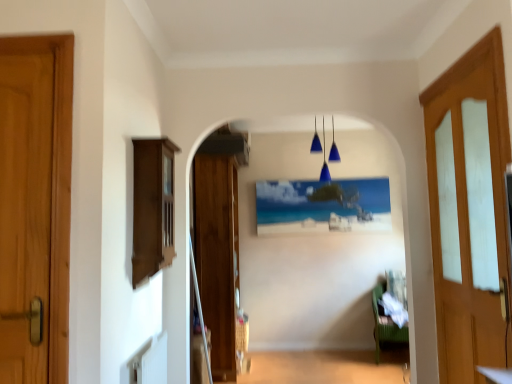
Image resolution: width=512 pixels, height=384 pixels. I want to click on wooden door at left, which is the 1th door from left to right, so tap(57, 190).

This screenshot has width=512, height=384. I want to click on matte plastic picture frame at center, so click(x=323, y=206).

Find the location of a particular element. Image resolution: width=512 pixels, height=384 pixels. green fabric couch at lower right is located at coordinates (385, 325).

Based on their sizes in the image, would you say blue glass pendant lights at center is bigger or smaller than wooden door at center, which is the second door from left to right?

blue glass pendant lights at center is smaller than wooden door at center, which is the second door from left to right.

Is blue glass pendant lights at center oriented towards wooden door at center, the first door viewed from the back?

No, blue glass pendant lights at center is not facing towards wooden door at center, the first door viewed from the back.

Considering the relative positions of blue glass pendant lights at center and wooden door at center, the second door viewed from the right, in the image provided, is blue glass pendant lights at center behind wooden door at center, the second door viewed from the right,?

Yes, it is behind wooden door at center, the second door viewed from the right.

Considering the points (334, 153) and (227, 269), which point is behind, point (334, 153) or point (227, 269)?

Positioned behind is point (334, 153).

From a real-world perspective, which is physically below, blue glass pendant lights at center or green fabric couch at lower right?

green fabric couch at lower right, from a real-world perspective.

You are a GUI agent. You are given a task and a screenshot of the screen. Output one action in this format:
    pyautogui.click(x=<x>, y=<y>)
    Task: Click on the furniture below the blue glass pendant lights at center (from the image's perspective)
    
    Given the screenshot: What is the action you would take?
    pyautogui.click(x=385, y=325)

Is blue glass pendant lights at center bigger or smaller than green fabric couch at lower right?

Clearly, blue glass pendant lights at center is smaller in size than green fabric couch at lower right.

Considering the relative positions of blue glass pendant lights at center and green fabric couch at lower right in the image provided, is blue glass pendant lights at center in front of green fabric couch at lower right?

That is True.

Which is closer to the camera, (259, 361) or (215, 284)?

Point (259, 361) is farther from the camera than point (215, 284).

Could you tell me if wooden staircase at center is facing wooden door at center, the third door from the front?

No.

In terms of size, does wooden staircase at center appear bigger or smaller than wooden door at center, the second door viewed from the right?

Considering their sizes, wooden staircase at center takes up less space than wooden door at center, the second door viewed from the right.

Is green fabric couch at lower right placed right next to wooden door at left, which appears as the first door when viewed from the front?

There is a gap between green fabric couch at lower right and wooden door at left, which appears as the first door when viewed from the front.

Is green fabric couch at lower right thinner than wooden door at left, which appears as the first door when viewed from the front?

No.

Where is `door that is the 3rd object located in front of the green fabric couch at lower right`? The height and width of the screenshot is (384, 512). door that is the 3rd object located in front of the green fabric couch at lower right is located at coordinates (57, 190).

Is green fabric couch at lower right turned away from wooden door at left, the third door viewed from the back?

No, green fabric couch at lower right's orientation is not away from wooden door at left, the third door viewed from the back.

From a real-world perspective, is matte plastic picture frame at center positioned over wooden door at center, the third door from the front, based on gravity?

Yes, from a real-world perspective, matte plastic picture frame at center is over wooden door at center, the third door from the front

Does point (367, 193) come closer to viewer compared to point (201, 289)?

No, (367, 193) is behind (201, 289).

From the image's perspective, is matte plastic picture frame at center above or below wooden door at center, the third door from the front?

From the image's perspective, matte plastic picture frame at center appears above wooden door at center, the third door from the front.

Considering the relative sizes of matte plastic picture frame at center and wooden door at center, which is the second door from left to right, in the image provided, is matte plastic picture frame at center smaller than wooden door at center, which is the second door from left to right,?

Yes.

From the image's perspective, is matte plastic picture frame at center located above or below brown wood cabinet at left?

matte plastic picture frame at center is situated lower than brown wood cabinet at left in the image.

Which object is wider, matte plastic picture frame at center or brown wood cabinet at left?

With larger width is brown wood cabinet at left.

Would you say matte plastic picture frame at center contains brown wood cabinet at left?

No, brown wood cabinet at left is not a part of matte plastic picture frame at center.

How distant is matte plastic picture frame at center from brown wood cabinet at left?

matte plastic picture frame at center and brown wood cabinet at left are 8.10 feet apart.

From the image's perspective, is white glossy table at lower right located above or below brown wood cabinet at left?

Clearly, from the image's perspective, white glossy table at lower right is below brown wood cabinet at left.

Does white glossy table at lower right appear on the left side of brown wood cabinet at left?

In fact, white glossy table at lower right is to the right of brown wood cabinet at left.

Is white glossy table at lower right placed right next to brown wood cabinet at left?

white glossy table at lower right and brown wood cabinet at left are clearly separated.

Considering the positions of objects white glossy table at lower right and brown wood cabinet at left in the image provided, who is in front, white glossy table at lower right or brown wood cabinet at left?

white glossy table at lower right is closer to the camera.

Find the location of a particular element. The image size is (512, 384). the 1st door in front of the blue glass pendant lights at center, starting your count from the anchor is located at coordinates (217, 255).

Identify the location of furniture on the right of blue glass pendant lights at center. The width and height of the screenshot is (512, 384). (385, 325).

Based on their spatial positions, is wooden door at left, which is the third door from right to left, or brown wood cabinet at left closer to white glossy table at lower right?

Among the two, brown wood cabinet at left is located nearer to white glossy table at lower right.

Estimate the real-world distances between objects in this image. Which object is closer to wooden door at center, the second door viewed from the right, green fabric couch at lower right or matte plastic picture frame at center?

Based on the image, matte plastic picture frame at center appears to be nearer to wooden door at center, the second door viewed from the right.

Estimate the real-world distances between objects in this image. Which object is closer to blue glass pendant lights at center, light brown wooden door at right, arranged as the first door when viewed from the right, or green fabric couch at lower right?

green fabric couch at lower right.

Looking at the image, which one is located further to light brown wooden door at right, which is the 2th door in back-to-front order, wooden staircase at center or wooden door at center, which is the second door from left to right?

Among the two, wooden door at center, which is the second door from left to right, is located further to light brown wooden door at right, which is the 2th door in back-to-front order.

Looking at the image, which one is located further to green fabric couch at lower right, wooden door at left, which is the third door from right to left, or matte plastic picture frame at center?

wooden door at left, which is the third door from right to left.

Looking at the image, which one is located further to light brown wooden door at right, arranged as the first door when viewed from the right, wooden door at left, which is the third door from right to left, or matte plastic picture frame at center?

Based on the image, matte plastic picture frame at center appears to be further to light brown wooden door at right, arranged as the first door when viewed from the right.

When comparing their distances from wooden staircase at center, does wooden door at center, which is the second door from left to right, or light brown wooden door at right, which is the 2th door in back-to-front order, seem further?

Among the two, light brown wooden door at right, which is the 2th door in back-to-front order, is located further to wooden staircase at center.

Considering their positions, is wooden door at center, which is the second door from left to right, positioned further to wooden door at left, which is the third door from right to left, than white glossy table at lower right?

wooden door at center, which is the second door from left to right, is positioned further to the anchor wooden door at left, which is the third door from right to left.

Where is `cabinetry located between white glossy table at lower right and wooden staircase at center in the depth direction`? The image size is (512, 384). cabinetry located between white glossy table at lower right and wooden staircase at center in the depth direction is located at coordinates (152, 207).

The width and height of the screenshot is (512, 384). What are the coordinates of `cabinetry between wooden door at left, the third door viewed from the back, and white glossy table at lower right, in the horizontal direction` in the screenshot? It's located at (152, 207).

This screenshot has width=512, height=384. Identify the location of path between white glossy table at lower right and blue glass pendant lights at center along the z-axis. (326, 367).

Where is `cabinetry between wooden door at left, the third door viewed from the back, and green fabric couch at lower right, along the z-axis`? cabinetry between wooden door at left, the third door viewed from the back, and green fabric couch at lower right, along the z-axis is located at coordinates (152, 207).